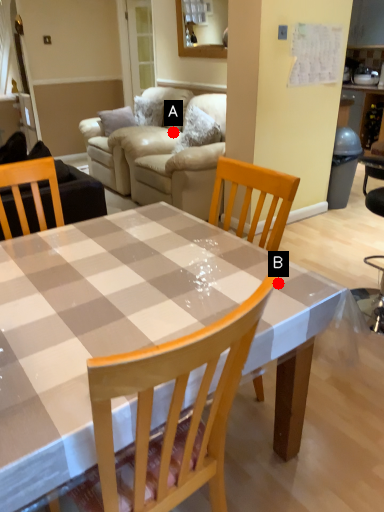
Question: Two points are circled on the image, labeled by A and B beside each circle. Which of the following is the closest to the observer?

Choices:
 (A) A is closer
 (B) B is closer

Answer: (B)